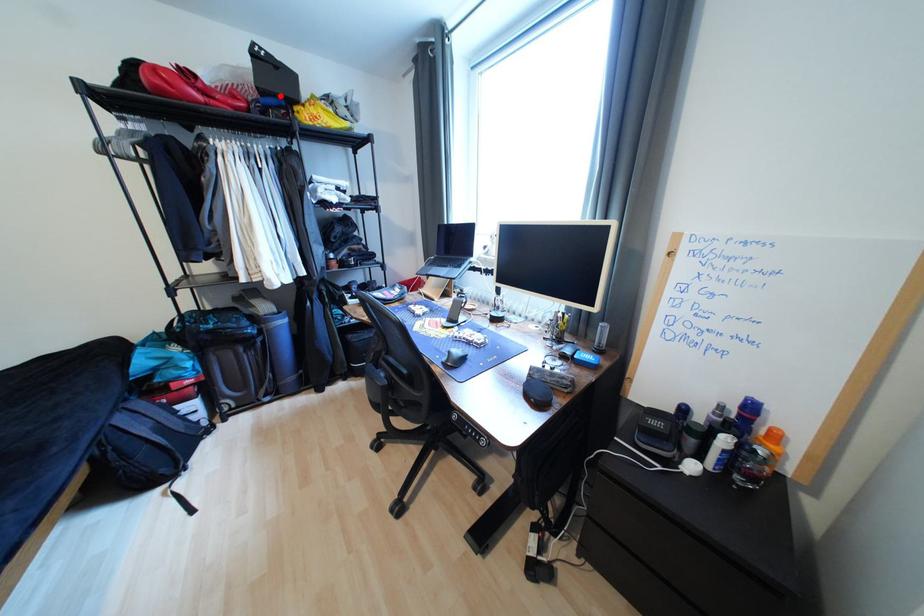
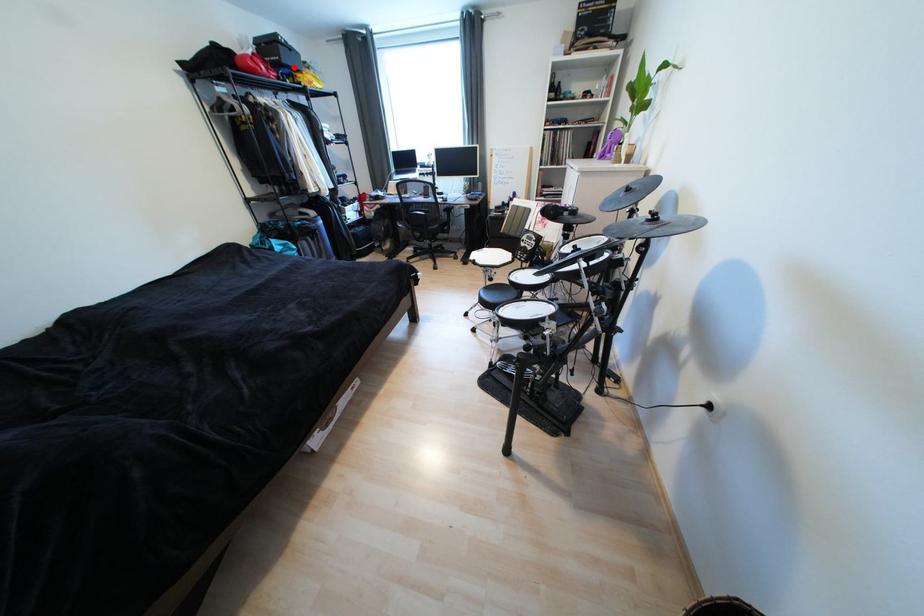
I am providing you with two images of the same scene from different viewpoints. A red point is marked on the first image and another point is marked on the second image. Does the point marked in image1 correspond to the same location as the one in image2?

Yes